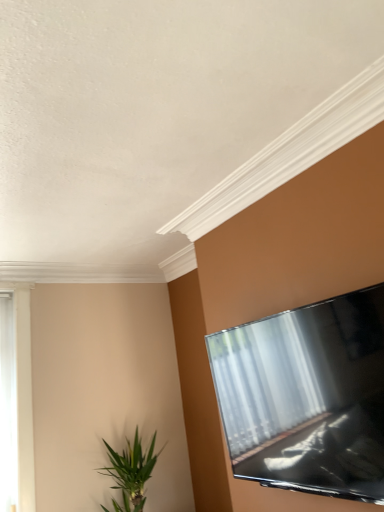
Question: Can white wooden window at left be found inside green leafy plant at lower left?

Choices:
 (A) yes
 (B) no

Answer: (B)

Question: From the image's perspective, is green leafy plant at lower left located above white wooden window at left?

Choices:
 (A) yes
 (B) no

Answer: (B)

Question: Is green leafy plant at lower left thinner than white wooden window at left?

Choices:
 (A) yes
 (B) no

Answer: (B)

Question: Is green leafy plant at lower left outside white wooden window at left?

Choices:
 (A) yes
 (B) no

Answer: (A)

Question: Considering the relative sizes of green leafy plant at lower left and white wooden window at left in the image provided, is green leafy plant at lower left wider than white wooden window at left?

Choices:
 (A) no
 (B) yes

Answer: (B)

Question: Does green leafy plant at lower left come in front of white wooden window at left?

Choices:
 (A) yes
 (B) no

Answer: (A)

Question: Considering the relative sizes of white wooden window at left and green leafy plant at lower left in the image provided, is white wooden window at left thinner than green leafy plant at lower left?

Choices:
 (A) yes
 (B) no

Answer: (A)

Question: Can you confirm if white wooden window at left is shorter than green leafy plant at lower left?

Choices:
 (A) no
 (B) yes

Answer: (A)

Question: Does white wooden window at left have a greater height compared to green leafy plant at lower left?

Choices:
 (A) yes
 (B) no

Answer: (A)

Question: Is white wooden window at left outside of green leafy plant at lower left?

Choices:
 (A) no
 (B) yes

Answer: (B)

Question: Is white wooden window at left bigger than green leafy plant at lower left?

Choices:
 (A) yes
 (B) no

Answer: (B)

Question: From the image's perspective, is white wooden window at left above green leafy plant at lower left?

Choices:
 (A) yes
 (B) no

Answer: (A)

Question: In the image, is green leafy plant at lower left on the left side or the right side of white wooden window at left?

Choices:
 (A) right
 (B) left

Answer: (A)